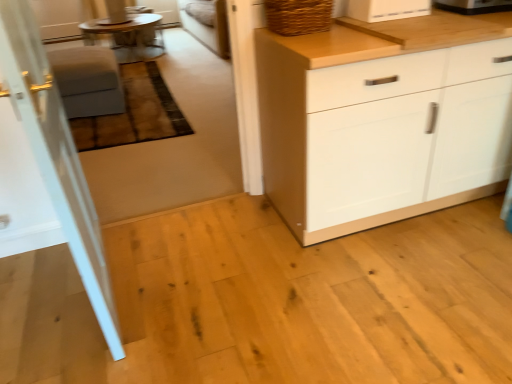
Question: From their relative heights in the image, would you say matte gray stool at left is taller or shorter than wooden round table at upper left?

Choices:
 (A) short
 (B) tall

Answer: (B)

Question: Considering their positions, is matte gray stool at left located in front of or behind wooden round table at upper left?

Choices:
 (A) behind
 (B) front

Answer: (B)

Question: Which object is the closest to the white glossy door at left?

Choices:
 (A) white matte cabinet at center
 (B) woven brown basket at upper right
 (C) black plastic toaster at upper right, which is the second appliance from left to right
 (D) wooden round table at upper left
 (E) matte gray stool at left

Answer: (B)

Question: Estimate the real-world distances between objects in this image. Which object is closer to the woven brown basket at upper right?

Choices:
 (A) white glossy toaster at upper center, placed as the 1th appliance when sorted from left to right
 (B) matte gray stool at left
 (C) white glossy door at left
 (D) white matte cabinet at center
 (E) black plastic toaster at upper right, which is counted as the 1th appliance, starting from the right

Answer: (A)